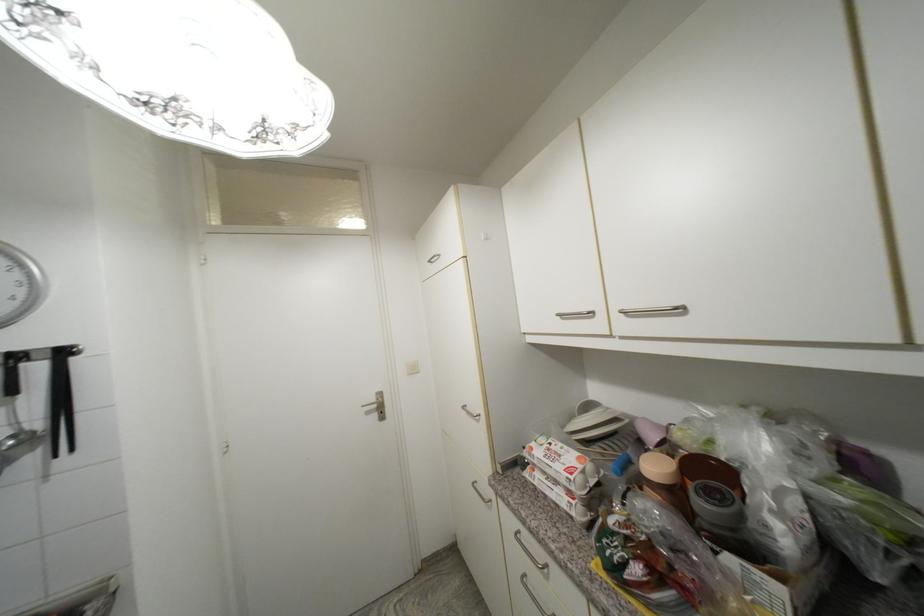
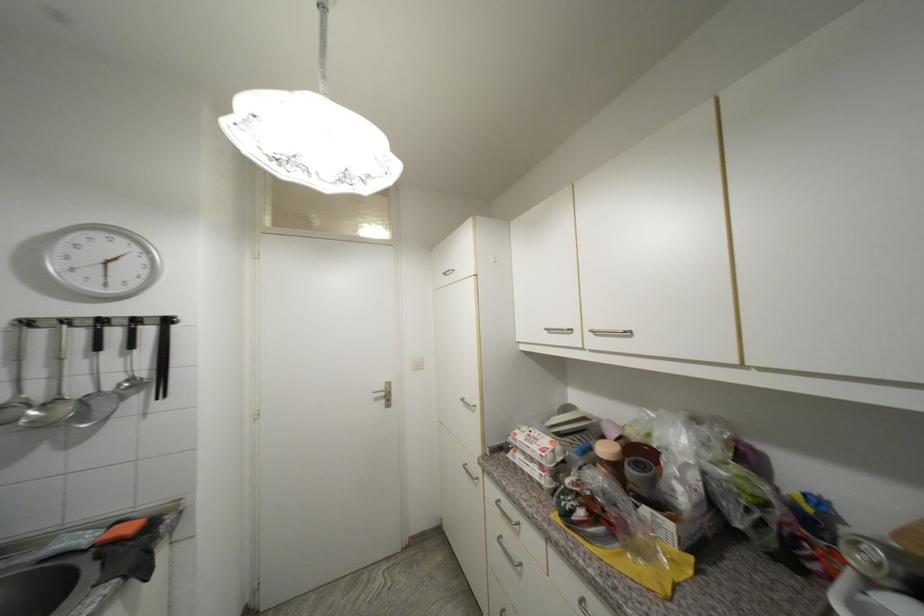
The point at (x=380, y=400) is marked in the first image. Where is the corresponding point in the second image?

(388, 390)